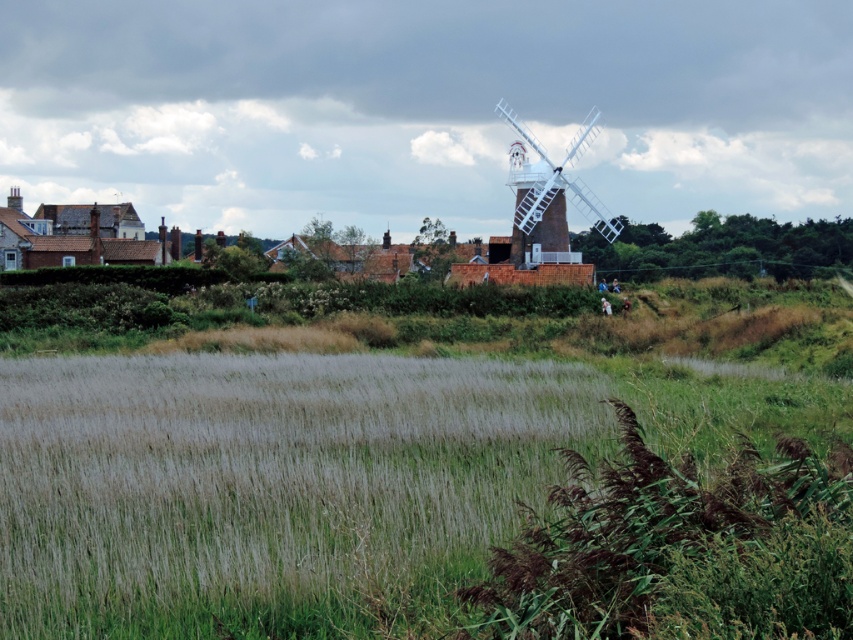
Between green grassy rice field at lower left and brown fuzzy plant at lower right, which one has more height?

green grassy rice field at lower left

Is green grassy rice field at lower left wider than brown fuzzy plant at lower right?

Yes, green grassy rice field at lower left is wider than brown fuzzy plant at lower right.

Describe the element at coordinates (310, 481) in the screenshot. I see `green grassy rice field at lower left` at that location.

The image size is (853, 640). Identify the location of green grassy rice field at lower left. (310, 481).

Between brown fuzzy plant at lower right and white wooden windmill at center, which one appears on the left side from the viewer's perspective?

brown fuzzy plant at lower right

Who is positioned more to the right, brown fuzzy plant at lower right or white wooden windmill at center?

white wooden windmill at center

Does point (815, 618) come closer to viewer compared to point (578, 132)?

That is True.

Locate an element on the screen. This screenshot has width=853, height=640. brown fuzzy plant at lower right is located at coordinates (677, 550).

Can you confirm if green grassy rice field at lower left is wider than white wooden windmill at center?

Correct, the width of green grassy rice field at lower left exceeds that of white wooden windmill at center.

Which is above, green grassy rice field at lower left or white wooden windmill at center?

white wooden windmill at center is above.

Identify the location of green grassy rice field at lower left. The width and height of the screenshot is (853, 640). (310, 481).